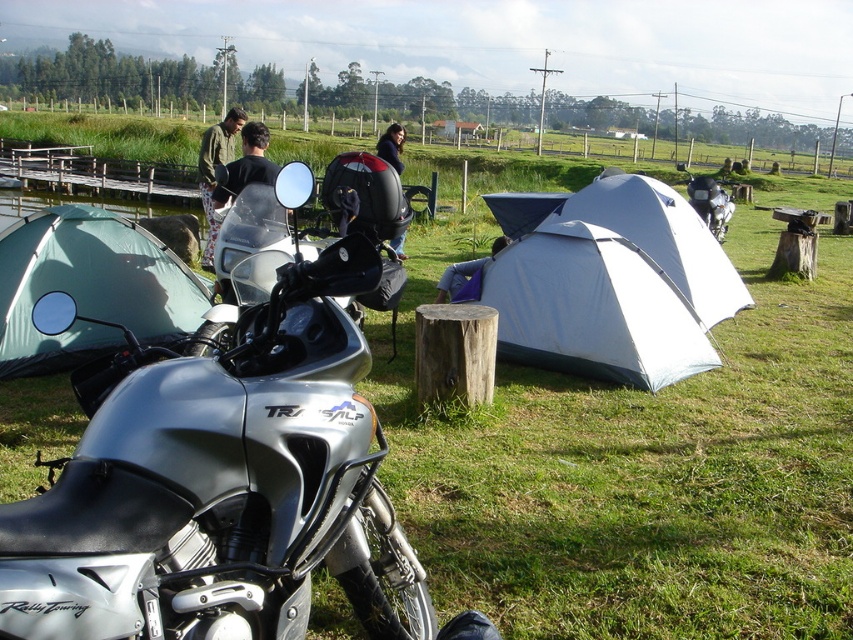
You are a hiker who wants to take a photo of the silver metallic motorcycle at center. You are standing 1.5 meters away from it. Can you reach the motorcycle to take the photo without moving?

The silver metallic motorcycle at center is 1.22 meters away from the viewer, so you are actually 0.28 meters closer than you think. You can easily reach it to take the photo without moving.

You are a hiker who wants to set up a new tent between the white fabric tent at center and the green fabric tent at left. Based on their positions, which tent should you place your new tent closer to in order to be between them?

You should place your new tent closer to the green fabric tent at left because the white fabric tent at center is to the right of the green fabric tent at left, so positioning it near the left tent will keep it between both.